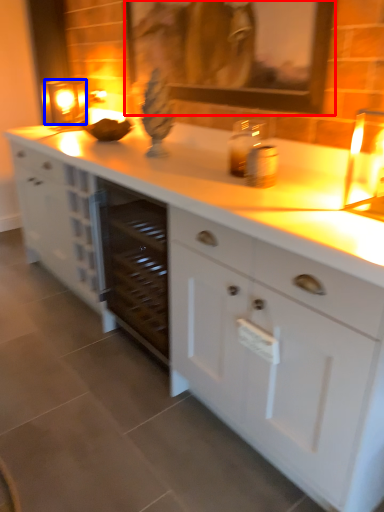
Question: Which object appears farthest to the camera in this image, picture frame (highlighted by a red box) or candle holder (highlighted by a blue box)?

Choices:
 (A) picture frame
 (B) candle holder

Answer: (B)